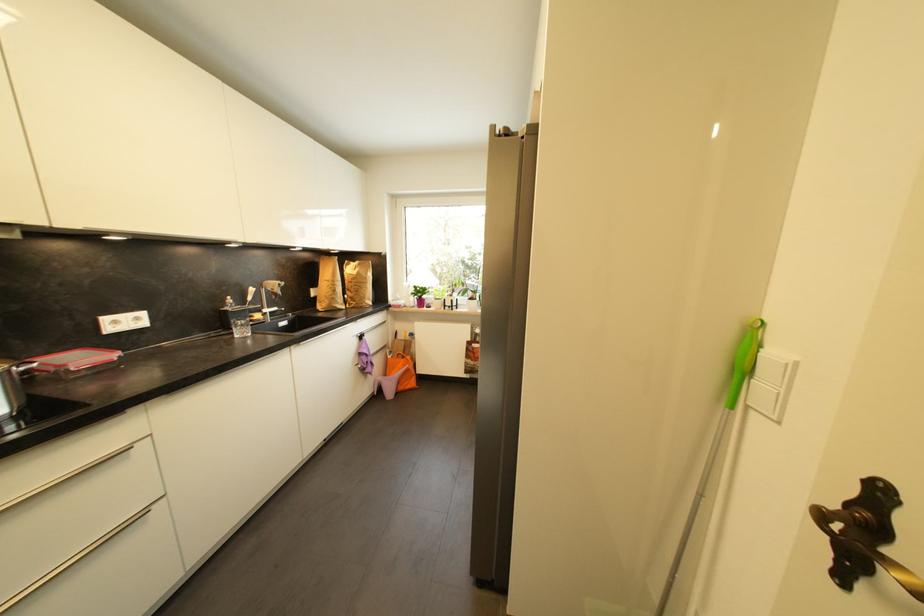
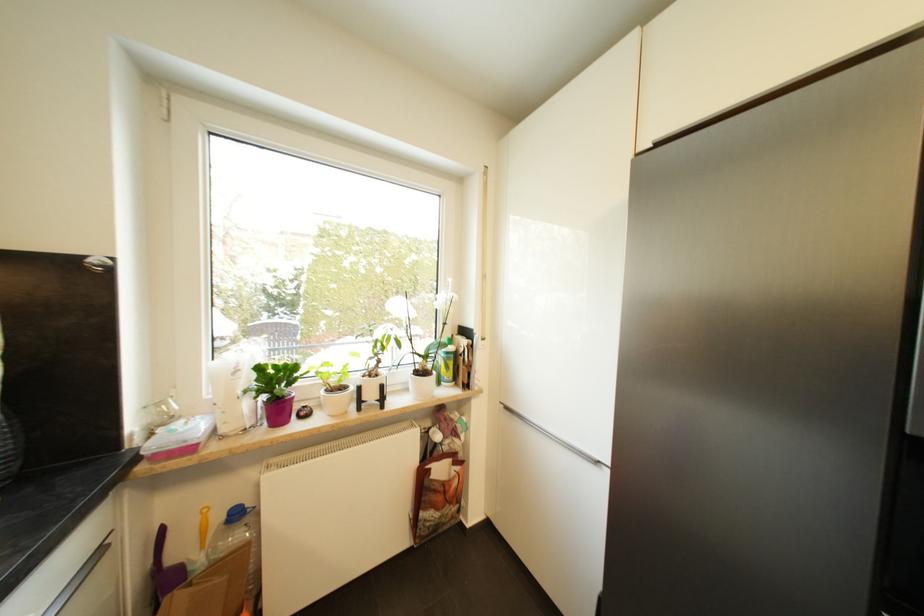
Where in the second image is the point corresponding to (x=441, y=301) from the first image?

(336, 392)